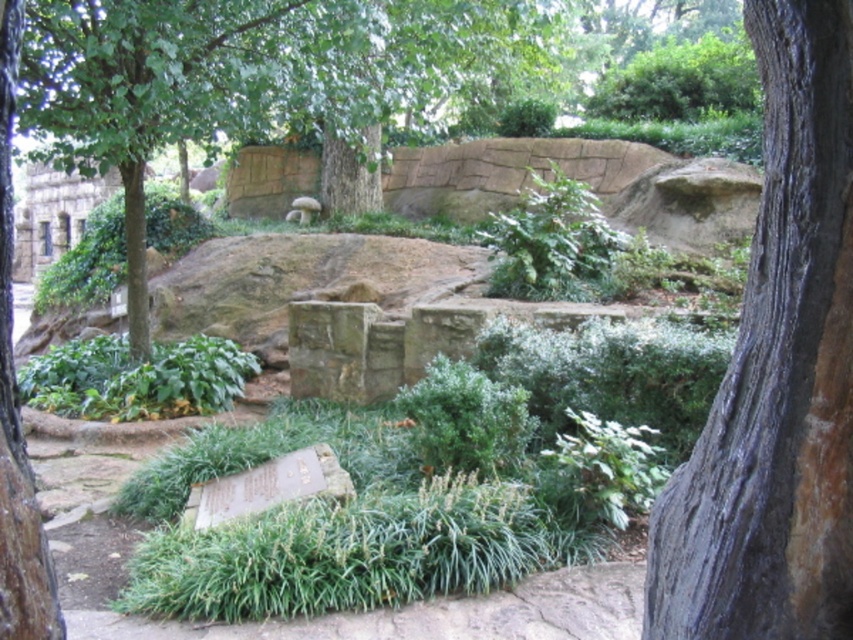
Is gray textured bark at center positioned behind green leafy tree at upper center?

That is False.

Who is lower down, gray textured bark at center or green leafy tree at upper center?

Positioned lower is gray textured bark at center.

Is point (772, 589) closer to camera compared to point (190, 10)?

Yes, it is.

You are a GUI agent. You are given a task and a screenshot of the screen. Output one action in this format:
    pyautogui.click(x=<x>, y=<y>)
    Task: Click on the gray textured bark at center
    This screenshot has width=853, height=640.
    Given the screenshot: What is the action you would take?
    pyautogui.click(x=776, y=376)

Is brown rough bark at left thinner than white fuzzy animal at center?

Indeed, brown rough bark at left has a lesser width compared to white fuzzy animal at center.

Is brown rough bark at left bigger than white fuzzy animal at center?

Yes, brown rough bark at left is bigger than white fuzzy animal at center.

Find the location of a particular element. brown rough bark at left is located at coordinates (16, 408).

Can you confirm if green leafy tree at upper center is positioned above white fuzzy animal at center?

Yes.

Who is higher up, green leafy tree at upper center or white fuzzy animal at center?

Positioned higher is green leafy tree at upper center.

Where is `green leafy tree at upper center`? This screenshot has height=640, width=853. green leafy tree at upper center is located at coordinates (247, 77).

Find the location of `green leafy tree at upper center`. green leafy tree at upper center is located at coordinates click(247, 77).